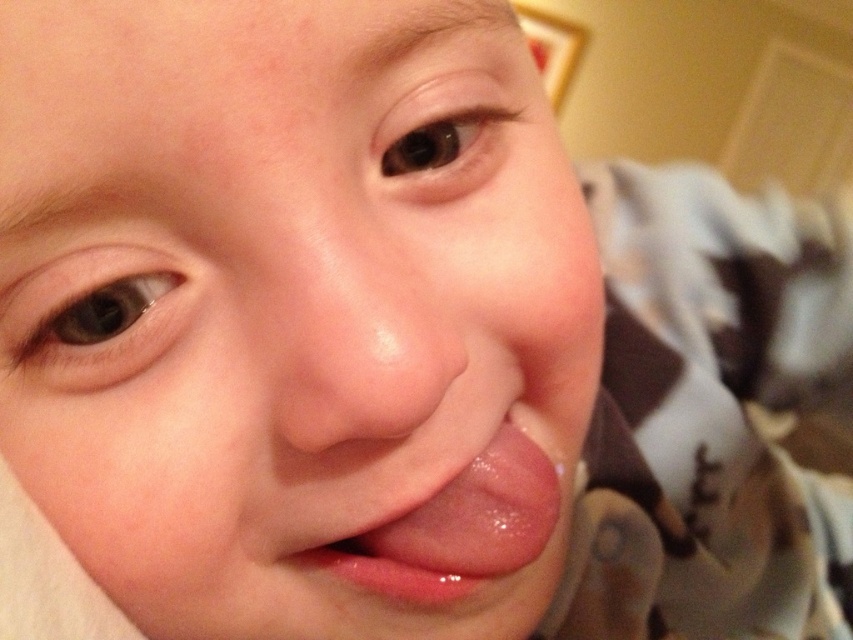
You are a photographer trying to adjust the lighting to highlight the child in the image. The point at coordinates point (357, 332) is where you want to focus the light. What part of the child should you focus the light on?

The point (357, 332) corresponds to the smooth flesh nose at center, so you should focus the light on the child nose.

In the scene shown: You are a photographer adjusting the focus on your camera. You want to ensure both the smooth skin face at center and the glossy pink tongue at center are in sharp focus. Given that your camera can only focus on objects within a 2 inch range, will both areas be in focus?

The distance between the smooth skin face at center and the glossy pink tongue at center is 2.17 inches, which exceeds the camera focus range of 2 inches. Therefore, both areas cannot be in focus simultaneously.

Based on the scene description, can you determine if the smooth skin face at center is wider than the glossy pink tongue at center?

The smooth skin face at center might be wider than glossy pink tongue at center according to the objects description.